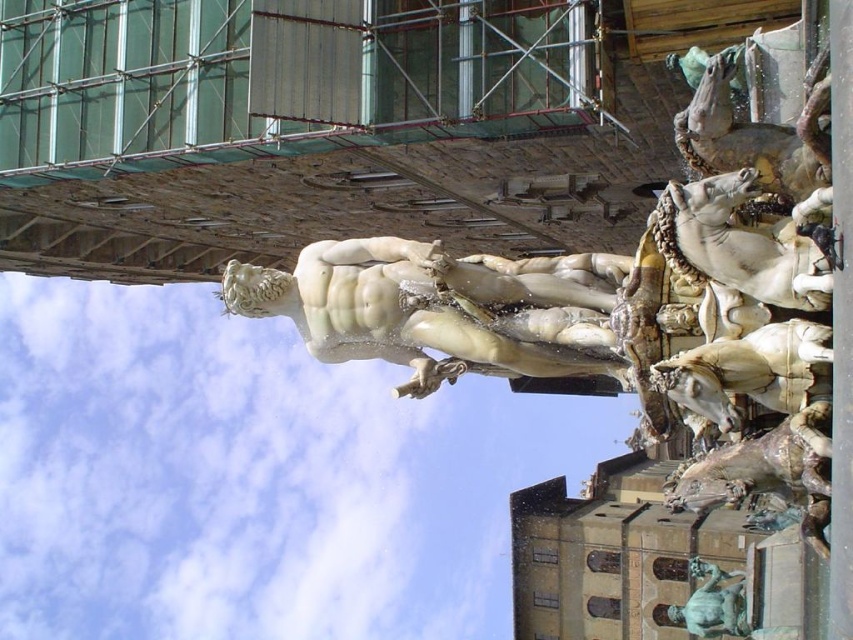
Can you confirm if white marble statue at center is shorter than bronze statue at lower right?

Indeed, white marble statue at center has a lesser height compared to bronze statue at lower right.

Between white marble statue at center and bronze statue at lower right, which one is positioned lower?

Positioned lower is bronze statue at lower right.

Who is more forward, (467, 340) or (705, 612)?

Point (467, 340) is in front.

Where is `white marble statue at center`? white marble statue at center is located at coordinates (410, 308).